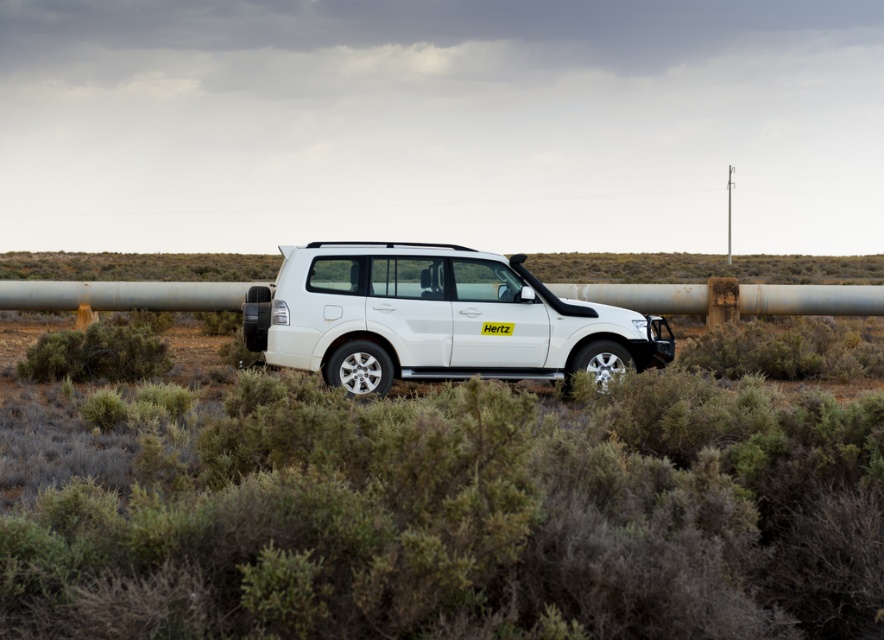
Question: Estimate the real-world distances between objects in this image. Which object is farther from the green shrubbery at center?

Choices:
 (A) brown shrub at lower left
 (B) white matte suv at center

Answer: (A)

Question: Estimate the real-world distances between objects in this image. Which object is closer to the white matte suv at center?

Choices:
 (A) green shrubbery at center
 (B) rusty metal pipe at center
 (C) brown shrub at lower left

Answer: (C)

Question: Which object is closer to the camera taking this photo?

Choices:
 (A) brown shrub at lower left
 (B) white matte suv at center
 (C) green shrubbery at center
 (D) rusty metal pipe at center

Answer: (C)

Question: Is green shrubbery at center above brown shrub at lower left?

Choices:
 (A) no
 (B) yes

Answer: (A)

Question: Does green shrubbery at center have a larger size compared to rusty metal pipe at center?

Choices:
 (A) no
 (B) yes

Answer: (A)

Question: Where is white matte suv at center located in relation to brown shrub at lower left in the image?

Choices:
 (A) left
 (B) right

Answer: (B)